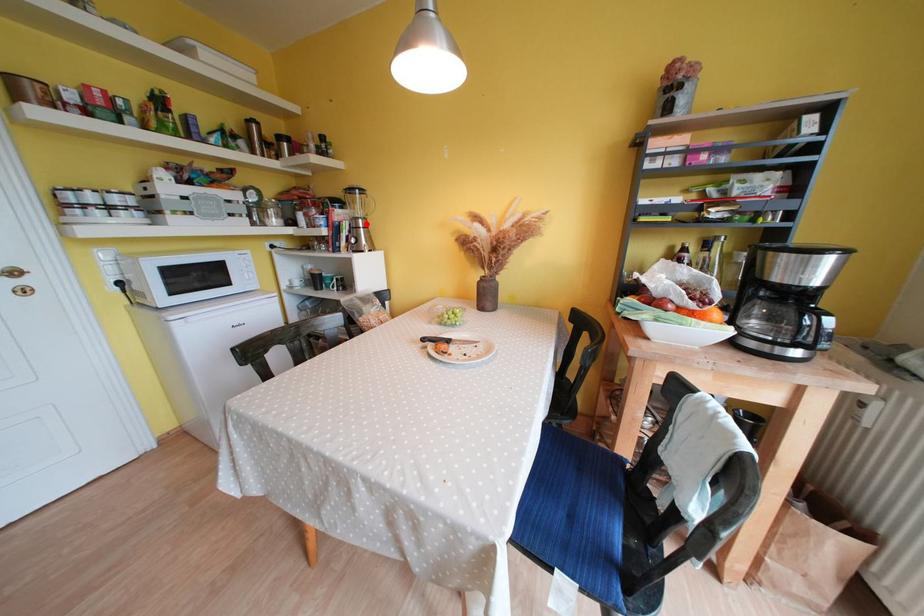
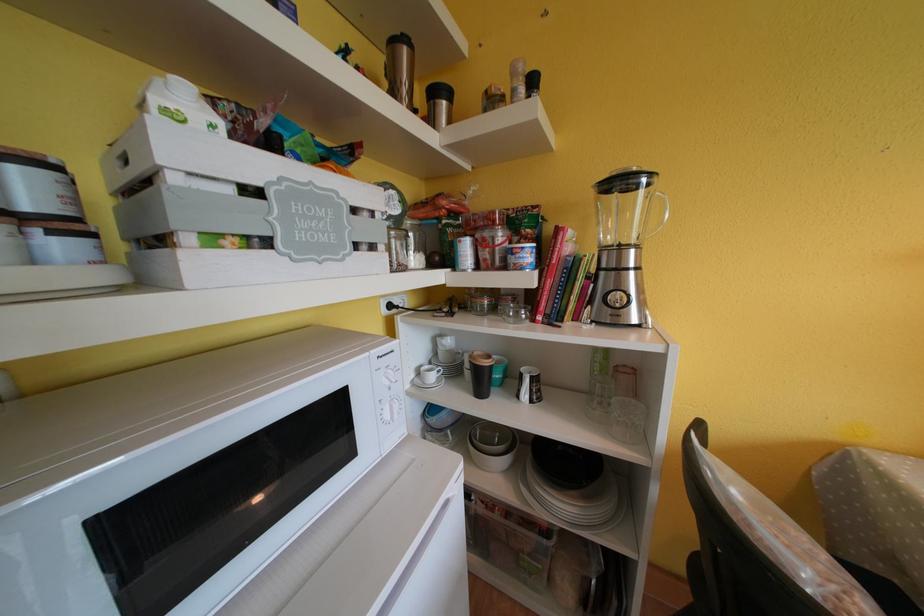
Question: A red point is marked in image1. In image2, is the corresponding 3D point closer to the camera or farther? Reply with the corresponding letter.

Choices:
 (A) The corresponding 3D point is closer.
 (B) The corresponding 3D point is farther.

Answer: (B)